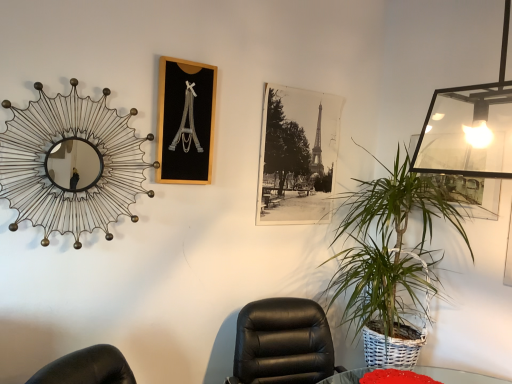
Describe the element at coordinates (283, 343) in the screenshot. I see `black leather chair at center` at that location.

You are a GUI agent. You are given a task and a screenshot of the screen. Output one action in this format:
    pyautogui.click(x=<x>, y=<y>)
    Task: Click on the black leather chair at center
    This screenshot has height=384, width=512.
    Given the screenshot: What is the action you would take?
    pyautogui.click(x=283, y=343)

What are the coordinates of `black paper photo at center, which is the first picture frame from right to left` in the screenshot? It's located at (297, 155).

Consider the image. Is black paper photo at center, which is the first picture frame from right to left, positioned with its back to metallic wire mirror at upper left?

No, metallic wire mirror at upper left is not at the back of black paper photo at center, which is the first picture frame from right to left.

From the image's perspective, between black paper photo at center, the first picture frame viewed from the back, and metallic wire mirror at upper left, which one is located above?

black paper photo at center, the first picture frame viewed from the back, from the image's perspective.

Locate an element on the screen. The image size is (512, 384). mirror lying in front of the black paper photo at center, the first picture frame viewed from the back is located at coordinates (71, 164).

In terms of width, does black paper photo at center, the first picture frame viewed from the back, look wider or thinner when compared to metallic wire mirror at upper left?

Clearly, black paper photo at center, the first picture frame viewed from the back, has less width compared to metallic wire mirror at upper left.

Is black wood picture frame at upper center, arranged as the first picture frame when viewed from the front, aimed at metallic wire mirror at upper left?

No, black wood picture frame at upper center, arranged as the first picture frame when viewed from the front, is not facing towards metallic wire mirror at upper left.

From the image's perspective, is black wood picture frame at upper center, arranged as the first picture frame when viewed from the front, beneath metallic wire mirror at upper left?

No, from the image's perspective, black wood picture frame at upper center, arranged as the first picture frame when viewed from the front, is not beneath metallic wire mirror at upper left.

Is point (196, 162) positioned in front of point (23, 164)?

No, it is behind (23, 164).

Considering the relative sizes of black wood picture frame at upper center, the 2th picture frame viewed from the back, and metallic wire mirror at upper left in the image provided, is black wood picture frame at upper center, the 2th picture frame viewed from the back, wider than metallic wire mirror at upper left?

Incorrect, the width of black wood picture frame at upper center, the 2th picture frame viewed from the back, does not surpass that of metallic wire mirror at upper left.

Between green woven basket at right and black wood picture frame at upper center, the 1th picture frame when ordered from left to right, which one has smaller width?

With smaller width is black wood picture frame at upper center, the 1th picture frame when ordered from left to right.

Does green woven basket at right have a larger size compared to black wood picture frame at upper center, the 2th picture frame viewed from the back?

Correct, green woven basket at right is larger in size than black wood picture frame at upper center, the 2th picture frame viewed from the back.

Is green woven basket at right beside black wood picture frame at upper center, marked as the second picture frame in a right-to-left arrangement?

No, green woven basket at right is not next to black wood picture frame at upper center, marked as the second picture frame in a right-to-left arrangement.

From the image's perspective, which one is positioned higher, green woven basket at right or black wood picture frame at upper center, the 1th picture frame when ordered from left to right?

black wood picture frame at upper center, the 1th picture frame when ordered from left to right, from the image's perspective.

Is black leather chair at center shorter than metallic wire mirror at upper left?

Yes, black leather chair at center is shorter than metallic wire mirror at upper left.

Does point (277, 382) lie in front of point (39, 88)?

No, it is not.

In terms of size, does black leather chair at center appear bigger or smaller than metallic wire mirror at upper left?

Clearly, black leather chair at center is larger in size than metallic wire mirror at upper left.

From the picture: From the image's perspective, is black leather chair at center over metallic wire mirror at upper left?

No, from the image's perspective, black leather chair at center is not over metallic wire mirror at upper left.

From a real-world perspective, which object stands above the other?

In real-world perspective, black wood picture frame at upper center, the 1th picture frame when ordered from left to right, is above.

Find the location of a particular element. Image resolution: width=512 pixels, height=384 pixels. chair to the right of black wood picture frame at upper center, the 2th picture frame viewed from the back is located at coordinates (283, 343).

Consider the image. Can you confirm if black leather chair at center is thinner than black wood picture frame at upper center, the 1th picture frame when ordered from left to right?

No.

Is black leather chair at center not within black wood picture frame at upper center, marked as the second picture frame in a right-to-left arrangement?

black leather chair at center is positioned outside black wood picture frame at upper center, marked as the second picture frame in a right-to-left arrangement.

Could you measure the distance between black wood picture frame at upper center, arranged as the first picture frame when viewed from the front, and black leather chair at center?

black wood picture frame at upper center, arranged as the first picture frame when viewed from the front, and black leather chair at center are 88.08 centimeters apart.

Considering the relative sizes of black wood picture frame at upper center, marked as the second picture frame in a right-to-left arrangement, and black leather chair at center in the image provided, is black wood picture frame at upper center, marked as the second picture frame in a right-to-left arrangement, wider than black leather chair at center?

In fact, black wood picture frame at upper center, marked as the second picture frame in a right-to-left arrangement, might be narrower than black leather chair at center.

Considering the positions of points (175, 99) and (330, 344), is point (175, 99) closer to camera compared to point (330, 344)?

Yes, point (175, 99) is in front of point (330, 344).

Can you confirm if black wood picture frame at upper center, the 2th picture frame viewed from the back, is shorter than black leather chair at center?

In fact, black wood picture frame at upper center, the 2th picture frame viewed from the back, may be taller than black leather chair at center.

From the picture: Measure the distance between black paper photo at center, placed as the second picture frame when sorted from front to back, and black wood picture frame at upper center, the 1th picture frame when ordered from left to right.

black paper photo at center, placed as the second picture frame when sorted from front to back, and black wood picture frame at upper center, the 1th picture frame when ordered from left to right, are 18.85 inches apart.

Can you confirm if black paper photo at center, marked as the 2th picture frame in a left-to-right arrangement, is shorter than black wood picture frame at upper center, arranged as the first picture frame when viewed from the front?

Incorrect, the height of black paper photo at center, marked as the 2th picture frame in a left-to-right arrangement, does not fall short of that of black wood picture frame at upper center, arranged as the first picture frame when viewed from the front.

In the image, is black paper photo at center, which is the first picture frame from right to left, positioned in front of or behind black wood picture frame at upper center, arranged as the first picture frame when viewed from the front?

Visually, black paper photo at center, which is the first picture frame from right to left, is located behind black wood picture frame at upper center, arranged as the first picture frame when viewed from the front.

Does point (280, 130) lie behind point (191, 93)?

That is True.

Identify the location of mirror that is on the left side of black paper photo at center, marked as the 2th picture frame in a left-to-right arrangement. This screenshot has height=384, width=512. (71, 164).

Where is `mirror in front of the black wood picture frame at upper center, marked as the second picture frame in a right-to-left arrangement`? mirror in front of the black wood picture frame at upper center, marked as the second picture frame in a right-to-left arrangement is located at coordinates (71, 164).

Which object lies nearer to the anchor point green woven basket at right, metallic wire mirror at upper left or black paper photo at center, the first picture frame viewed from the back?

The object closer to green woven basket at right is black paper photo at center, the first picture frame viewed from the back.

Looking at the image, which one is located further to green woven basket at right, black wood picture frame at upper center, arranged as the first picture frame when viewed from the front, or black leather chair at center?

black wood picture frame at upper center, arranged as the first picture frame when viewed from the front.

Looking at the image, which one is located further to black leather chair at center, metallic wire mirror at upper left or black wood picture frame at upper center, the 1th picture frame when ordered from left to right?

→ metallic wire mirror at upper left.

Considering their positions, is black paper photo at center, placed as the second picture frame when sorted from front to back, positioned closer to black wood picture frame at upper center, the 1th picture frame when ordered from left to right, than green woven basket at right?

black paper photo at center, placed as the second picture frame when sorted from front to back, is closer to black wood picture frame at upper center, the 1th picture frame when ordered from left to right.

From the image, which object appears to be farther from black wood picture frame at upper center, the 1th picture frame when ordered from left to right, black paper photo at center, the first picture frame viewed from the back, or metallic wire mirror at upper left?

black paper photo at center, the first picture frame viewed from the back, is further to black wood picture frame at upper center, the 1th picture frame when ordered from left to right.

When comparing their distances from black leather chair at center, does black wood picture frame at upper center, arranged as the first picture frame when viewed from the front, or black paper photo at center, placed as the second picture frame when sorted from front to back, seem further?

black wood picture frame at upper center, arranged as the first picture frame when viewed from the front.

Based on their spatial positions, is green woven basket at right or metallic wire mirror at upper left closer to black wood picture frame at upper center, the 1th picture frame when ordered from left to right?

Based on the image, metallic wire mirror at upper left appears to be nearer to black wood picture frame at upper center, the 1th picture frame when ordered from left to right.

Based on their spatial positions, is green woven basket at right or black paper photo at center, placed as the second picture frame when sorted from front to back, further from black leather chair at center?

black paper photo at center, placed as the second picture frame when sorted from front to back.

I want to click on chair located between metallic wire mirror at upper left and green woven basket at right in the left-right direction, so [283, 343].

Where is `picture frame between black wood picture frame at upper center, the 1th picture frame when ordered from left to right, and black leather chair at center in the up-down direction`? Image resolution: width=512 pixels, height=384 pixels. picture frame between black wood picture frame at upper center, the 1th picture frame when ordered from left to right, and black leather chair at center in the up-down direction is located at coordinates (297, 155).

Where is `picture frame between black wood picture frame at upper center, the 2th picture frame viewed from the back, and green woven basket at right, in the horizontal direction`? picture frame between black wood picture frame at upper center, the 2th picture frame viewed from the back, and green woven basket at right, in the horizontal direction is located at coordinates (297, 155).

The width and height of the screenshot is (512, 384). In order to click on mirror between black wood picture frame at upper center, the 1th picture frame when ordered from left to right, and black leather chair at center, in the vertical direction in this screenshot , I will do (x=71, y=164).